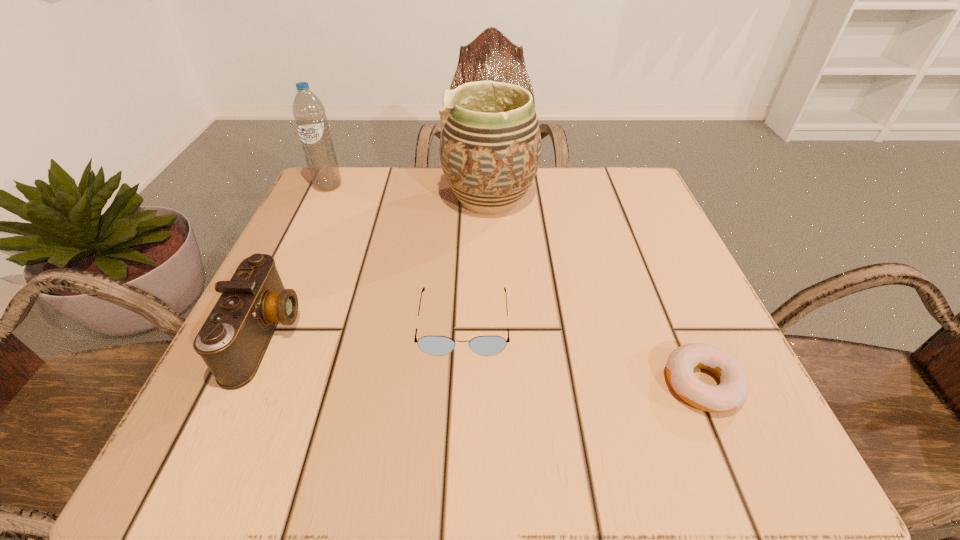
Locate an element on the screen. This screenshot has height=540, width=960. vacant space situated on the left of the rightmost object is located at coordinates (478, 384).

Where is `pottery at the far edge`? pottery at the far edge is located at coordinates (490, 144).

You are a GUI agent. You are given a task and a screenshot of the screen. Output one action in this format:
    pyautogui.click(x=<x>, y=<y>)
    Task: Click on the water bottle positioned at the far edge
    
    Given the screenshot: What is the action you would take?
    pyautogui.click(x=309, y=113)

The width and height of the screenshot is (960, 540). I want to click on object that is positioned at the near edge, so click(732, 392).

You are a GUI agent. You are given a task and a screenshot of the screen. Output one action in this format:
    pyautogui.click(x=<x>, y=<y>)
    Task: Click on the water bottle that is at the left edge
    The width and height of the screenshot is (960, 540).
    Given the screenshot: What is the action you would take?
    pyautogui.click(x=309, y=113)

This screenshot has height=540, width=960. In order to click on camera located at the left edge in this screenshot , I will do `click(232, 342)`.

Where is `object that is at the right edge`? The image size is (960, 540). object that is at the right edge is located at coordinates (732, 392).

Image resolution: width=960 pixels, height=540 pixels. Find the location of `object positioned at the far left corner`. object positioned at the far left corner is located at coordinates (309, 113).

This screenshot has height=540, width=960. Identify the location of object that is at the near right corner. (732, 392).

You are a GUI agent. You are given a task and a screenshot of the screen. Output one action in this format:
    pyautogui.click(x=<x>, y=<y>)
    Task: Click on the free space at the far edge of the desktop
    The image size is (960, 540).
    Given the screenshot: What is the action you would take?
    pyautogui.click(x=463, y=219)